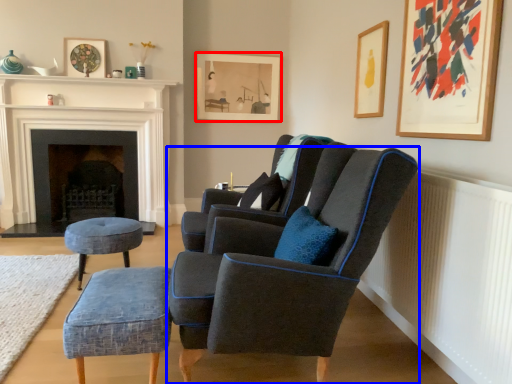
Question: Which of the following is the farthest to the observer, picture frame (highlighted by a red box) or chair (highlighted by a blue box)?

Choices:
 (A) picture frame
 (B) chair

Answer: (A)